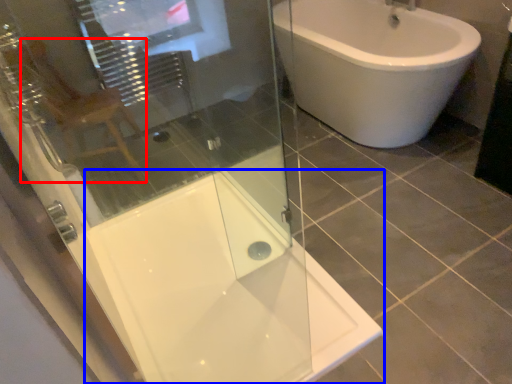
Question: Which of the following is the farthest to the observer, gray (highlighted by a red box) or bath (highlighted by a blue box)?

Choices:
 (A) gray
 (B) bath

Answer: (A)